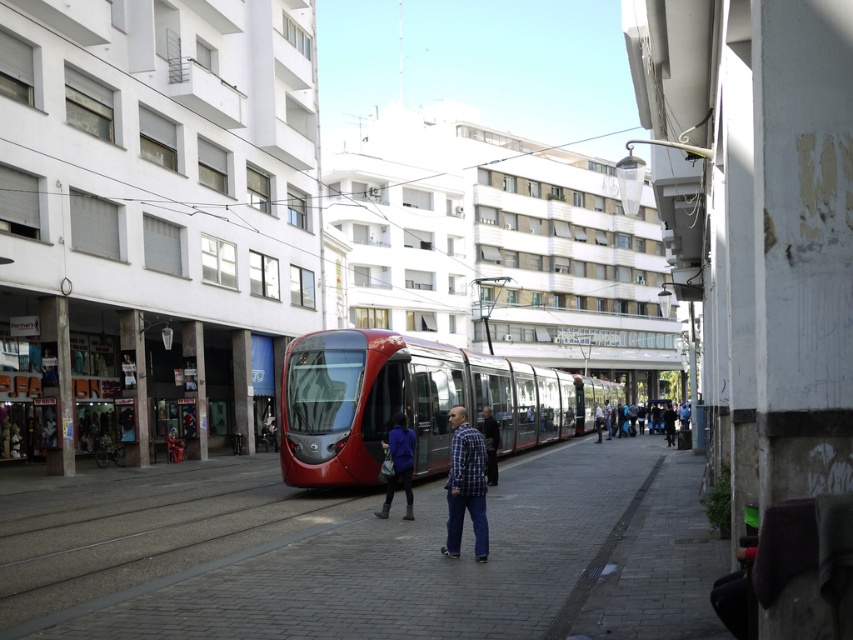
Question: In this image, where is plaid shirt at center located relative to matte blue jacket at center?

Choices:
 (A) right
 (B) left

Answer: (A)

Question: Can you confirm if plaid shirt at center is positioned above blue denim jeans at center?

Choices:
 (A) yes
 (B) no

Answer: (A)

Question: Is dark blue shirt at center closer to camera compared to blue denim jeans at center?

Choices:
 (A) no
 (B) yes

Answer: (B)

Question: Which of the following is the closest to the observer?

Choices:
 (A) (601, 410)
 (B) (496, 449)
 (C) (526, 429)

Answer: (B)

Question: Which object is farther from the camera taking this photo?

Choices:
 (A) blue denim jeans at center
 (B) matte blue jacket at center

Answer: (A)

Question: Which point appears closest to the camera in this image?

Choices:
 (A) (601, 436)
 (B) (405, 454)
 (C) (489, 403)

Answer: (B)